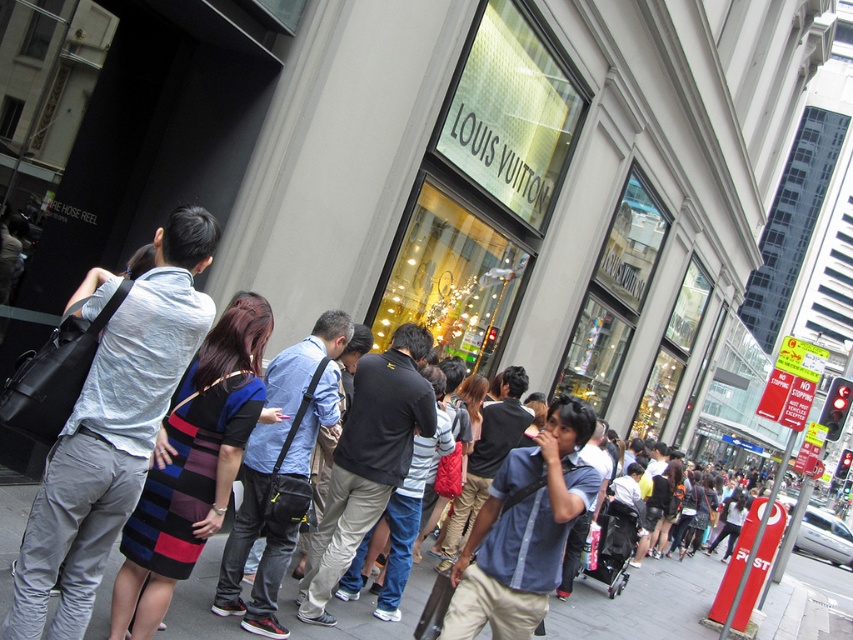
Question: Which point is closer to the camera taking this photo?

Choices:
 (A) (544, 525)
 (B) (67, 634)

Answer: (B)

Question: Which of the following is the farthest from the observer?

Choices:
 (A) pyautogui.click(x=355, y=634)
 (B) pyautogui.click(x=175, y=564)

Answer: (A)

Question: Does blue striped dress at center have a greater width compared to multicolored knit dress at center?

Choices:
 (A) no
 (B) yes

Answer: (B)

Question: Can you confirm if blue striped dress at center is thinner than glassy gold display at center?

Choices:
 (A) no
 (B) yes

Answer: (B)

Question: Is blue denim shirt at center smaller than glassy gold display at center?

Choices:
 (A) no
 (B) yes

Answer: (B)

Question: Considering the real-world distances, which object is closest to the multicolored knit dress at center?

Choices:
 (A) glassy gold display at center
 (B) blue striped dress at center

Answer: (B)